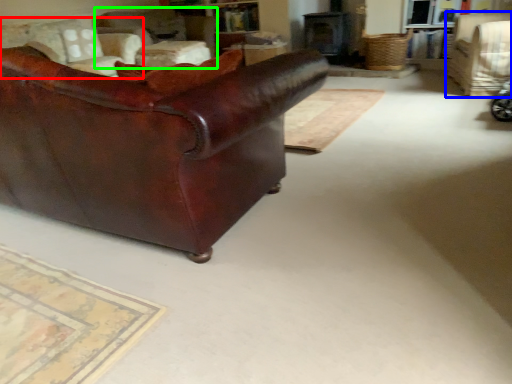
Question: Estimate the real-world distances between objects in this image. Which object is farther from chair (highlighted by a red box), chair (highlighted by a blue box) or chair (highlighted by a green box)?

Choices:
 (A) chair
 (B) chair

Answer: (A)